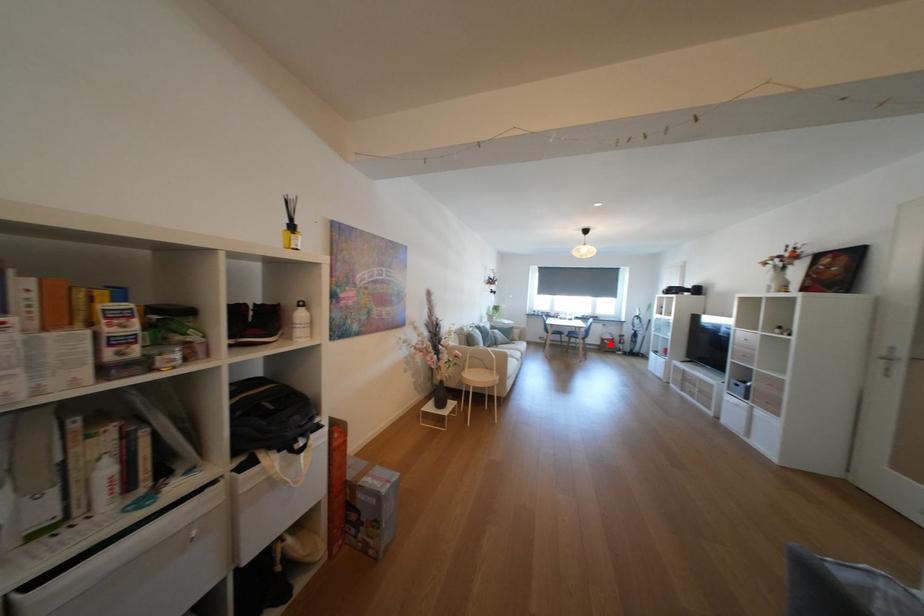
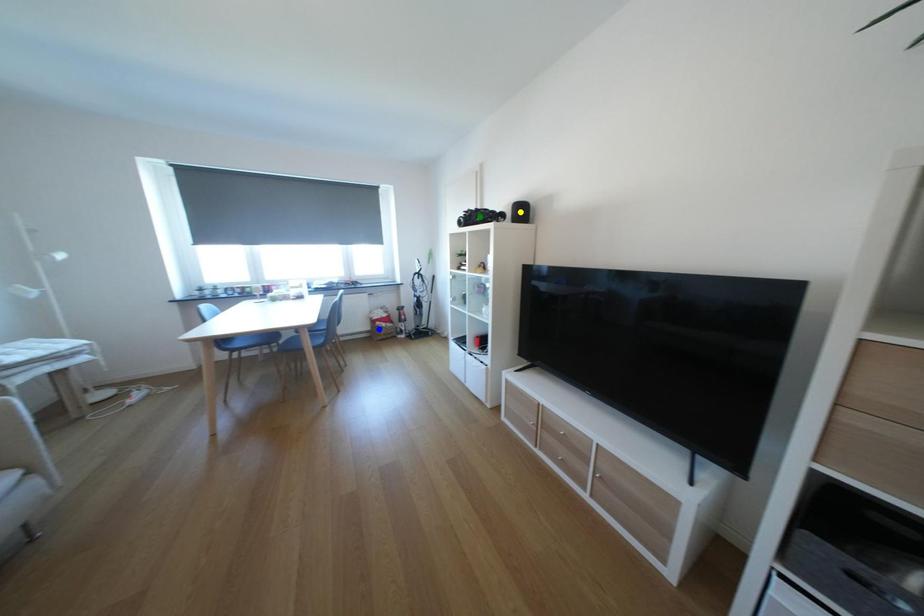
Question: I am providing you with two images of the same scene from different viewpoints. A red point is marked on the first image. You are given multiple points on the second image. Which spot in image 2 lines up with the point in image 1?

Choices:
 (A) green point
 (B) yellow point
 (C) blue point

Answer: (C)